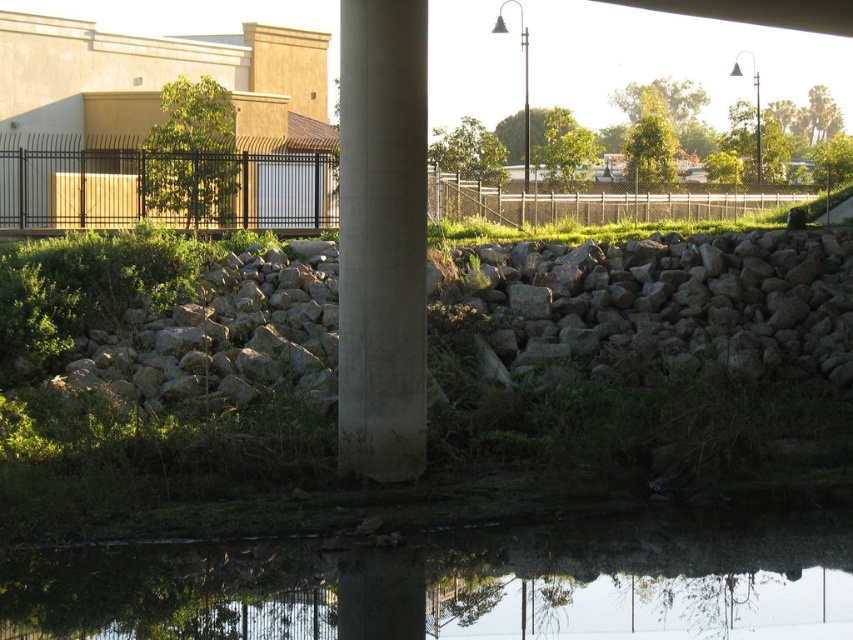
Question: Which of the following is the farthest from the observer?

Choices:
 (A) transparent glass water at center bottom
 (B) gray rough stone at center
 (C) smooth concrete pillar at center

Answer: (B)

Question: Which object is closer to the camera taking this photo?

Choices:
 (A) transparent glass water at center bottom
 (B) smooth concrete pillar at center
 (C) gray rough stone at center

Answer: (A)

Question: Does gray rough stone at center appear over smooth concrete pillar at center?

Choices:
 (A) no
 (B) yes

Answer: (A)

Question: Which object appears farthest from the camera in this image?

Choices:
 (A) transparent glass water at center bottom
 (B) gray rough stone at center

Answer: (B)

Question: Does gray rough stone at center have a lesser width compared to smooth concrete pillar at center?

Choices:
 (A) yes
 (B) no

Answer: (B)

Question: Is transparent glass water at center bottom thinner than gray rough stone at center?

Choices:
 (A) no
 (B) yes

Answer: (B)